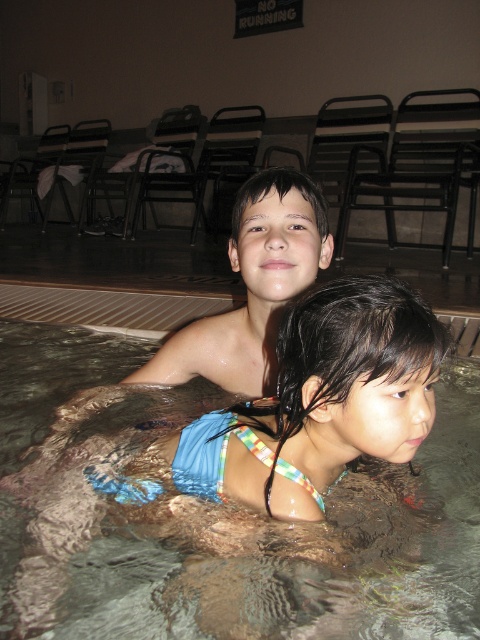
Is clear plastic water at upper center behind smooth skin boy at upper center?

No, clear plastic water at upper center is closer to the viewer.

Does clear plastic water at upper center appear over smooth skin boy at upper center?

Actually, clear plastic water at upper center is below smooth skin boy at upper center.

Which is in front, point (213, 531) or point (288, 189)?

Point (213, 531)

What are the coordinates of `clear plastic water at upper center` in the screenshot? It's located at (252, 541).